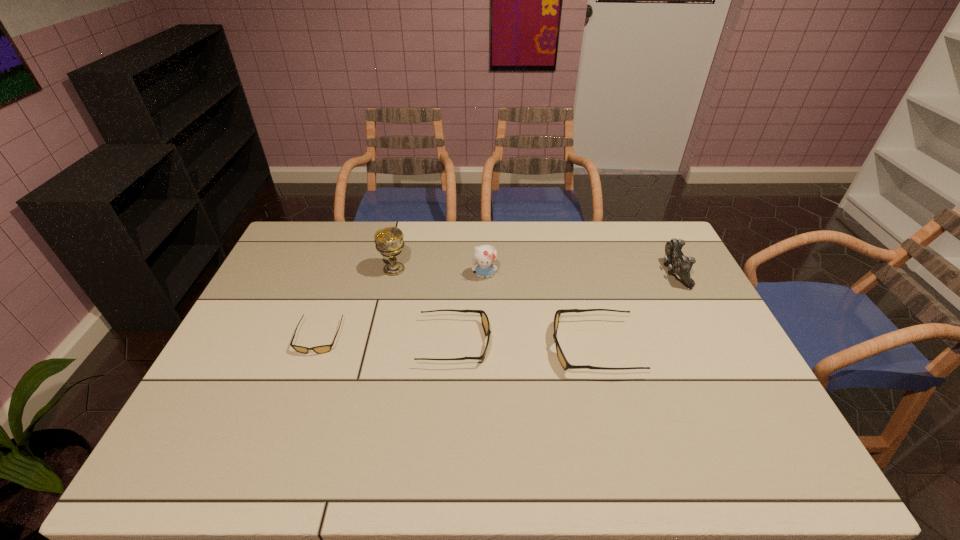
You are a GUI agent. You are given a task and a screenshot of the screen. Output one action in this format:
    pyautogui.click(x=<x>, y=<y>)
    Task: Click on the sunglasses that stands as the second closest to the second shortest object
    This screenshot has height=540, width=960.
    Given the screenshot: What is the action you would take?
    click(324, 348)

Point out which sunglasses is positioned as the nearest to the third tallest object. Please provide its 2D coordinates. Your answer should be formatted as a tuple, i.e. [(x, y)], where the tuple contains the x and y coordinates of a point satisfying the conditions above.

[(565, 364)]

I want to click on free location that satisfies the following two spatial constraints: 1. on the surface of the control with buttons; 2. on the front-facing side of the leftmost object, so click(707, 338).